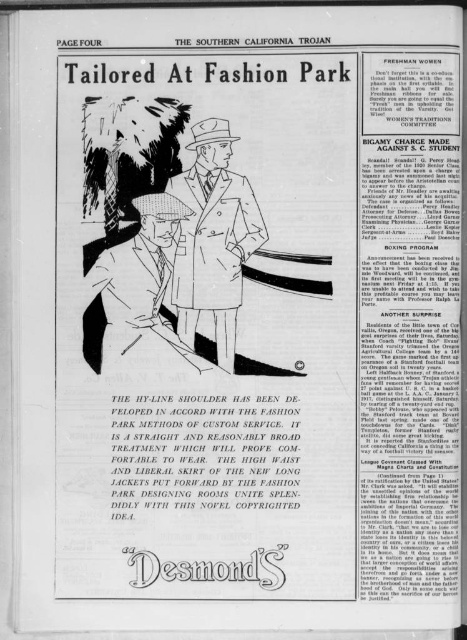
Question: Which point is farther to the camera?

Choices:
 (A) (219, 250)
 (B) (149, 266)

Answer: (B)

Question: Is light brown striped suit at center positioned in front of matte gray suit at center?

Choices:
 (A) yes
 (B) no

Answer: (A)

Question: Is light brown striped suit at center thinner than matte gray suit at center?

Choices:
 (A) no
 (B) yes

Answer: (B)

Question: Does light brown striped suit at center have a larger size compared to matte gray suit at center?

Choices:
 (A) no
 (B) yes

Answer: (B)